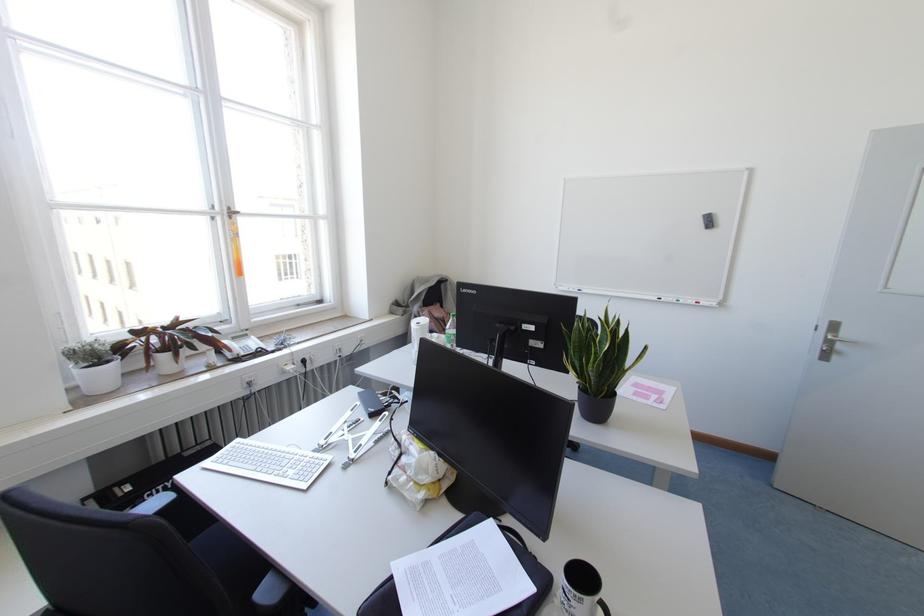
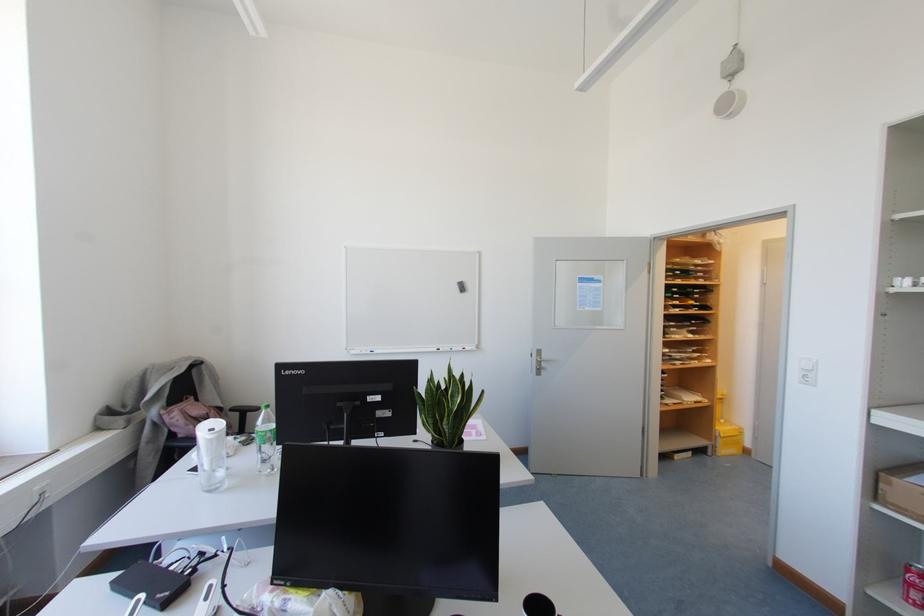
Question: Based on the continuous images, in which direction is the camera rotating? Reply with the corresponding letter.

Choices:
 (A) Left
 (B) Right
 (C) Up
 (D) Down

Answer: (B)